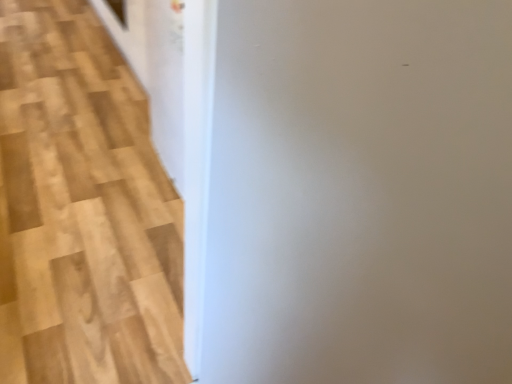
Measure the distance between white glossy door at upper center and camera.

white glossy door at upper center is 1.05 meters from camera.

The height and width of the screenshot is (384, 512). What do you see at coordinates (82, 209) in the screenshot?
I see `white glossy door at upper center` at bounding box center [82, 209].

At what (x,y) coordinates should I click in order to perform the action: click on white glossy door at upper center. Please return your answer as a coordinate pair (x, y). Looking at the image, I should click on (82, 209).

The image size is (512, 384). I want to click on white glossy door at upper center, so click(82, 209).